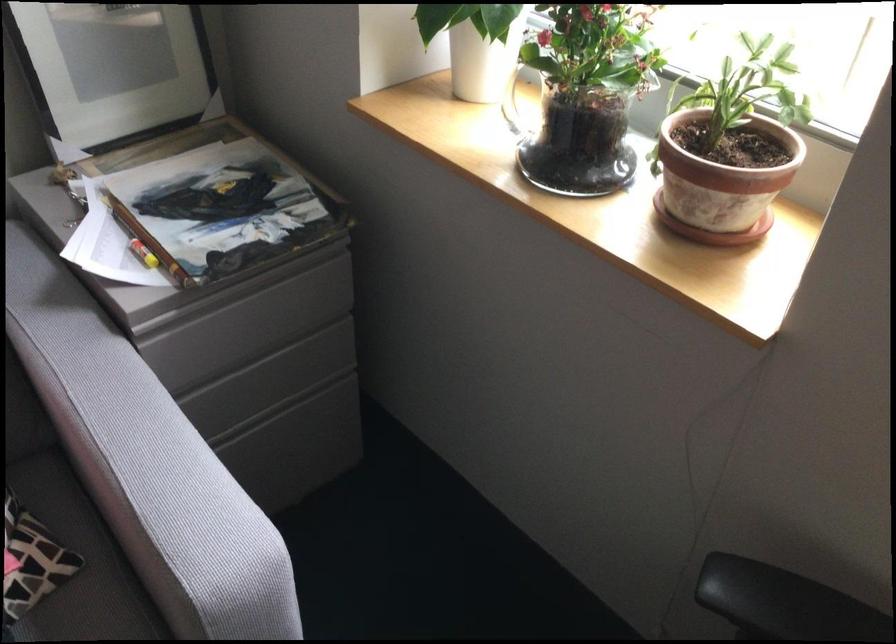
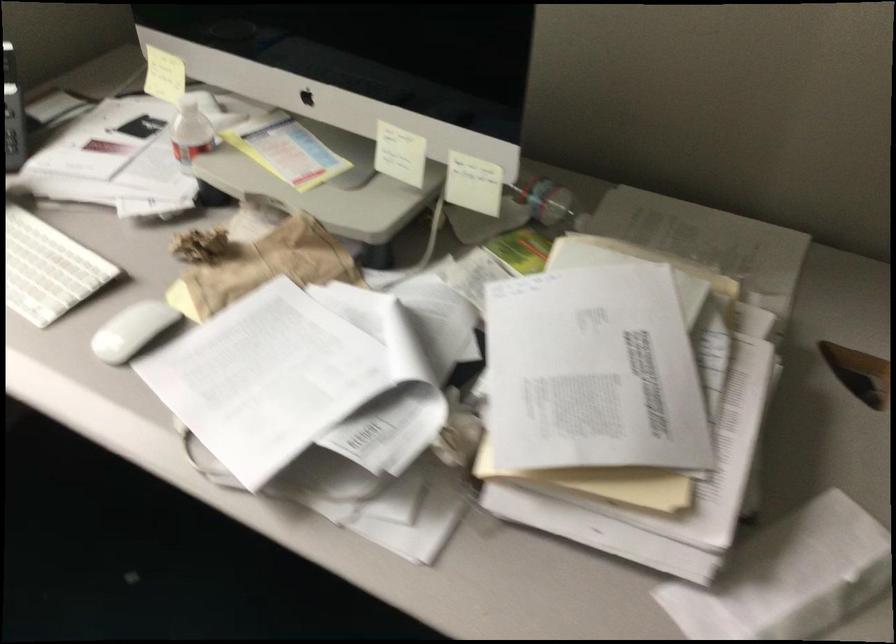
First-person continuous shooting, in which direction is the camera rotating?

The camera rotated toward right-down.